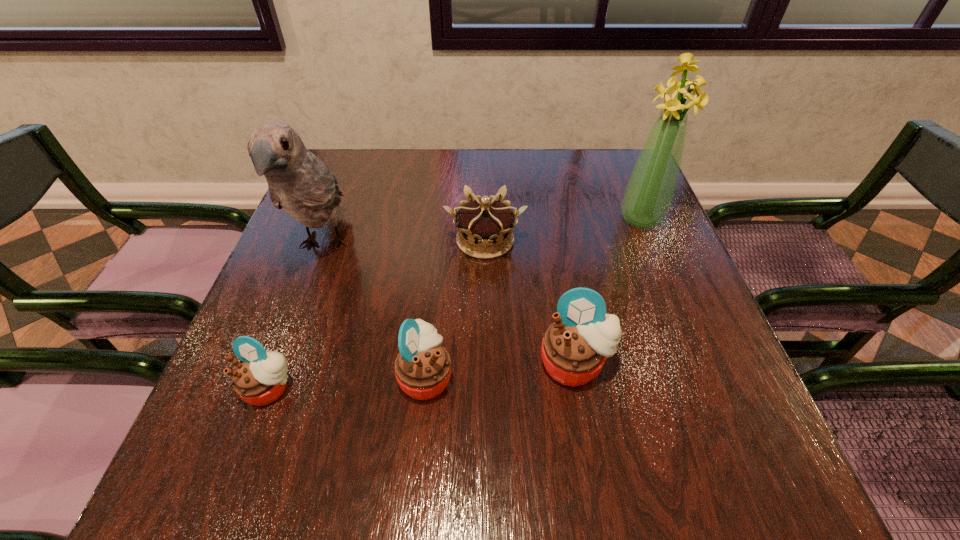
Identify the location of vacant area that lies between the rightmost object and the fourth tallest object. The height and width of the screenshot is (540, 960). (533, 298).

Locate an element on the screen. The height and width of the screenshot is (540, 960). object that ranks as the fourth closest to the second tallest muffin is located at coordinates (486, 223).

The image size is (960, 540). What are the coordinates of `object that stands as the fifth closest to the second tallest object` in the screenshot? It's located at (650, 190).

Locate which muffin is the closest to the crown. Please provide its 2D coordinates. Your answer should be formatted as a tuple, i.e. [(x, y)], where the tuple contains the x and y coordinates of a point satisfying the conditions above.

[(574, 349)]

Locate which muffin is the second closest to the fifth shortest object. Please provide its 2D coordinates. Your answer should be formatted as a tuple, i.e. [(x, y)], where the tuple contains the x and y coordinates of a point satisfying the conditions above.

[(423, 367)]

Locate an element on the screen. The height and width of the screenshot is (540, 960). blank area in the image that satisfies the following two spatial constraints: 1. on the front-facing side of the fifth object from left to right; 2. on the front-facing side of the fourth tallest object is located at coordinates (577, 376).

Where is `free space that satisfies the following two spatial constraints: 1. on the front-facing side of the fifth object from left to right; 2. on the front-facing side of the fourth tallest object`? This screenshot has width=960, height=540. free space that satisfies the following two spatial constraints: 1. on the front-facing side of the fifth object from left to right; 2. on the front-facing side of the fourth tallest object is located at coordinates (577, 376).